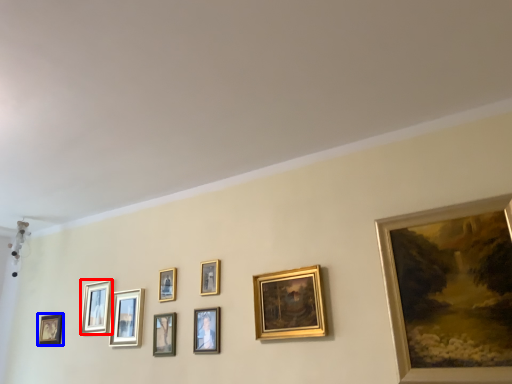
Question: Which object appears farthest to the camera in this image, picture frame (highlighted by a red box) or picture frame (highlighted by a blue box)?

Choices:
 (A) picture frame
 (B) picture frame

Answer: (B)